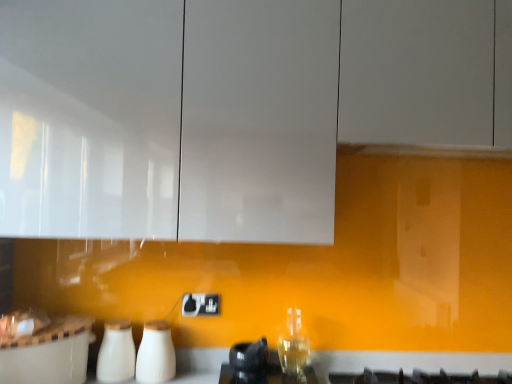
What is the approximate height of black plastic electric outlet at center?

3.77 inches.

Find the location of a particular element. The image size is (512, 384). black plastic electric outlet at center is located at coordinates (200, 304).

Would you say white glossy countertop at lower center contains white glossy milk bottles at lower center, which is counted as the second appliance, starting from the right?

Actually, white glossy milk bottles at lower center, which is counted as the second appliance, starting from the right, is outside white glossy countertop at lower center.

How different are the orientations of white glossy countertop at lower center and white glossy milk bottles at lower center, which is counted as the second appliance, starting from the right, in degrees?

There is a 17.9-degree angle between the facing directions of white glossy countertop at lower center and white glossy milk bottles at lower center, which is counted as the second appliance, starting from the right.

Is point (509, 368) closer to camera compared to point (132, 356)?

No, (509, 368) is behind (132, 356).

Can you confirm if white glossy countertop at lower center is positioned to the right of white glossy milk bottles at lower center, which is counted as the second appliance, starting from the right?

Yes.

Considering the relative sizes of black plastic electric outlet at center and white glossy milk bottles at lower center, which is counted as the second appliance, starting from the right, in the image provided, is black plastic electric outlet at center bigger than white glossy milk bottles at lower center, which is counted as the second appliance, starting from the right,?

No, black plastic electric outlet at center is not bigger than white glossy milk bottles at lower center, which is counted as the second appliance, starting from the right.

Who is more distant, black plastic electric outlet at center or white glossy milk bottles at lower center, the 1th appliance positioned from the left?

black plastic electric outlet at center is further away from the camera.

Is white glossy milk bottles at lower center, the 1th appliance positioned from the left, inside black plastic electric outlet at center?

No, black plastic electric outlet at center does not contain white glossy milk bottles at lower center, the 1th appliance positioned from the left.

Is point (204, 296) positioned behind point (141, 342)?

Yes, it is.

The height and width of the screenshot is (384, 512). I want to click on electric outlet that appears above the white glossy salt and pepper shakers at center, the 2th appliance positioned from the left (from the image's perspective), so click(x=200, y=304).

Is black plastic electric outlet at center to the left of white glossy salt and pepper shakers at center, the 2th appliance positioned from the left, from the viewer's perspective?

Incorrect, black plastic electric outlet at center is not on the left side of white glossy salt and pepper shakers at center, the 2th appliance positioned from the left.

Looking at their sizes, would you say black plastic electric outlet at center is wider or thinner than white glossy salt and pepper shakers at center, the 2th appliance positioned from the left?

black plastic electric outlet at center is thinner than white glossy salt and pepper shakers at center, the 2th appliance positioned from the left.

This screenshot has width=512, height=384. In order to click on cabinetry in front of the white glossy salt and pepper shakers at center, the 2th appliance positioned from the left in this screenshot , I will do `click(229, 108)`.

From the image's perspective, which is below, white glossy salt and pepper shakers at center, the first appliance in the right-to-left sequence, or white glossy cabinet at upper center?

From the image's view, white glossy salt and pepper shakers at center, the first appliance in the right-to-left sequence, is below.

From a real-world perspective, is white glossy salt and pepper shakers at center, the 2th appliance positioned from the left, positioned under white glossy cabinet at upper center based on gravity?

Yes, from a real-world perspective, white glossy salt and pepper shakers at center, the 2th appliance positioned from the left, is beneath white glossy cabinet at upper center.

Looking at this image, is white glossy salt and pepper shakers at center, the first appliance in the right-to-left sequence, touching white glossy cabinet at upper center?

No, white glossy salt and pepper shakers at center, the first appliance in the right-to-left sequence, is not beside white glossy cabinet at upper center.

Which point is more forward, (214, 314) or (369, 355)?

Point (369, 355)

Which object is more forward, black plastic electric outlet at center or white glossy countertop at lower center?

white glossy countertop at lower center is in front.

Considering the relative sizes of black plastic electric outlet at center and white glossy countertop at lower center in the image provided, is black plastic electric outlet at center taller than white glossy countertop at lower center?

In fact, black plastic electric outlet at center may be shorter than white glossy countertop at lower center.

Considering the relative positions of black plastic electric outlet at center and white glossy countertop at lower center in the image provided, is black plastic electric outlet at center to the left of white glossy countertop at lower center from the viewer's perspective?

Indeed, black plastic electric outlet at center is positioned on the left side of white glossy countertop at lower center.

Would you say white glossy cabinet at upper center is a long distance from white glossy milk bottles at lower center, the 1th appliance positioned from the left?

No.

From the image's perspective, between white glossy cabinet at upper center and white glossy milk bottles at lower center, the 1th appliance positioned from the left, which one is located above?

white glossy cabinet at upper center appears higher in the image.

From a real-world perspective, who is located higher, white glossy cabinet at upper center or white glossy milk bottles at lower center, the 1th appliance positioned from the left?

From a 3D spatial view, white glossy cabinet at upper center is above.

Where is `the 2nd appliance below the white glossy cabinet at upper center (from a real-world perspective)`? Image resolution: width=512 pixels, height=384 pixels. the 2nd appliance below the white glossy cabinet at upper center (from a real-world perspective) is located at coordinates (116, 353).

Which of these two, white glossy milk bottles at lower center, which is counted as the second appliance, starting from the right, or white glossy salt and pepper shakers at center, the 2th appliance positioned from the left, is wider?

white glossy milk bottles at lower center, which is counted as the second appliance, starting from the right, is wider.

Is white glossy milk bottles at lower center, which is counted as the second appliance, starting from the right, oriented towards white glossy salt and pepper shakers at center, the first appliance in the right-to-left sequence?

No, white glossy milk bottles at lower center, which is counted as the second appliance, starting from the right, is not facing towards white glossy salt and pepper shakers at center, the first appliance in the right-to-left sequence.

Which is behind, point (113, 353) or point (156, 369)?

The point (113, 353) is more distant.

From a real-world perspective, starting from the white glossy countertop at lower center, which appliance is the 1st one vertically above it? Please provide its 2D coordinates.

[(116, 353)]

You are a GUI agent. You are given a task and a screenshot of the screen. Output one action in this format:
    pyautogui.click(x=<x>, y=<y>)
    Task: Click on the electric outlet that is on the right side of white glossy milk bottles at lower center, the 1th appliance positioned from the left
    
    Given the screenshot: What is the action you would take?
    pyautogui.click(x=200, y=304)

Estimate the real-world distances between objects in this image. Which object is closer to white glossy salt and pepper shakers at center, the 2th appliance positioned from the left, white glossy cabinet at upper center or white glossy milk bottles at lower center, which is counted as the second appliance, starting from the right?

white glossy milk bottles at lower center, which is counted as the second appliance, starting from the right, lies closer to white glossy salt and pepper shakers at center, the 2th appliance positioned from the left, than the other object.

Looking at the image, which one is located further to white glossy cabinet at upper center, black plastic electric outlet at center or white glossy countertop at lower center?

Among the two, white glossy countertop at lower center is located further to white glossy cabinet at upper center.

From the picture: From the image, which object appears to be nearer to white glossy cabinet at upper center, white glossy countertop at lower center or white glossy milk bottles at lower center, the 1th appliance positioned from the left?

white glossy milk bottles at lower center, the 1th appliance positioned from the left, is closer to white glossy cabinet at upper center.

When comparing their distances from white glossy salt and pepper shakers at center, the first appliance in the right-to-left sequence, does black plastic electric outlet at center or white glossy cabinet at upper center seem further?

white glossy cabinet at upper center is positioned further to the anchor white glossy salt and pepper shakers at center, the first appliance in the right-to-left sequence.

When comparing their distances from white glossy salt and pepper shakers at center, the first appliance in the right-to-left sequence, does white glossy milk bottles at lower center, which is counted as the second appliance, starting from the right, or black plastic electric outlet at center seem further?

Based on the image, black plastic electric outlet at center appears to be further to white glossy salt and pepper shakers at center, the first appliance in the right-to-left sequence.

Looking at this image, based on their spatial positions, is white glossy milk bottles at lower center, the 1th appliance positioned from the left, or white glossy salt and pepper shakers at center, the first appliance in the right-to-left sequence, further from white glossy cabinet at upper center?

white glossy milk bottles at lower center, the 1th appliance positioned from the left, is further to white glossy cabinet at upper center.

From the picture: From the image, which object appears to be nearer to white glossy countertop at lower center, white glossy salt and pepper shakers at center, the 2th appliance positioned from the left, or white glossy milk bottles at lower center, which is counted as the second appliance, starting from the right?

The object closer to white glossy countertop at lower center is white glossy salt and pepper shakers at center, the 2th appliance positioned from the left.

Looking at the image, which one is located closer to white glossy cabinet at upper center, white glossy milk bottles at lower center, the 1th appliance positioned from the left, or white glossy countertop at lower center?

white glossy milk bottles at lower center, the 1th appliance positioned from the left.

Find the location of a particular element. The image size is (512, 384). electric outlet between white glossy cabinet at upper center and white glossy milk bottles at lower center, the 1th appliance positioned from the left, from top to bottom is located at coordinates [x=200, y=304].

Find the location of `appliance located between white glossy milk bottles at lower center, which is counted as the second appliance, starting from the right, and white glossy countertop at lower center in the left-right direction`. appliance located between white glossy milk bottles at lower center, which is counted as the second appliance, starting from the right, and white glossy countertop at lower center in the left-right direction is located at coordinates 156,354.

Locate an element on the screen. The height and width of the screenshot is (384, 512). electric outlet between white glossy salt and pepper shakers at center, the 2th appliance positioned from the left, and white glossy countertop at lower center is located at coordinates (200, 304).

Identify the location of electric outlet that lies between white glossy cabinet at upper center and white glossy salt and pepper shakers at center, the first appliance in the right-to-left sequence, from top to bottom. This screenshot has width=512, height=384. (200, 304).